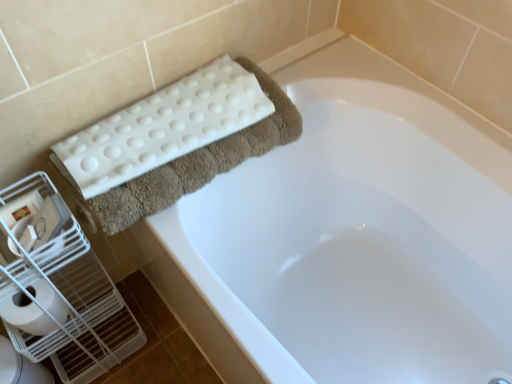
Question: Could you tell me if white glossy toilet bowl at lower left is turned towards white plastic bird cage at left?

Choices:
 (A) yes
 (B) no

Answer: (B)

Question: Is white glossy toilet bowl at lower left shorter than white plastic bird cage at left?

Choices:
 (A) no
 (B) yes

Answer: (B)

Question: Can you confirm if white glossy toilet bowl at lower left is wider than white plastic bird cage at left?

Choices:
 (A) yes
 (B) no

Answer: (A)

Question: Can you confirm if white glossy toilet bowl at lower left is bigger than white plastic bird cage at left?

Choices:
 (A) no
 (B) yes

Answer: (A)

Question: From the image's perspective, is white glossy toilet bowl at lower left beneath white plastic bird cage at left?

Choices:
 (A) yes
 (B) no

Answer: (A)

Question: Is white rubber mat at upper left in front of or behind white matte toilet paper at lower left in the image?

Choices:
 (A) front
 (B) behind

Answer: (A)

Question: Is white rubber mat at upper left inside or outside of white matte toilet paper at lower left?

Choices:
 (A) outside
 (B) inside

Answer: (A)

Question: Is white rubber mat at upper left wider or thinner than white matte toilet paper at lower left?

Choices:
 (A) thin
 (B) wide

Answer: (B)

Question: From their relative heights in the image, would you say white rubber mat at upper left is taller or shorter than white matte toilet paper at lower left?

Choices:
 (A) tall
 (B) short

Answer: (A)

Question: In terms of width, does white rubber mat at upper left look wider or thinner when compared to white textured bath towel at upper left?

Choices:
 (A) thin
 (B) wide

Answer: (B)

Question: Is white rubber mat at upper left spatially inside white textured bath towel at upper left, or outside of it?

Choices:
 (A) outside
 (B) inside

Answer: (A)

Question: Would you say white rubber mat at upper left is to the left or to the right of white textured bath towel at upper left in the picture?

Choices:
 (A) left
 (B) right

Answer: (B)

Question: Does point click(x=473, y=130) appear closer or farther from the camera than point click(x=129, y=142)?

Choices:
 (A) closer
 (B) farther

Answer: (B)

Question: Is white matte toilet paper at lower left inside or outside of white plastic bird cage at left?

Choices:
 (A) inside
 (B) outside

Answer: (A)

Question: Is white matte toilet paper at lower left in front of or behind white plastic bird cage at left in the image?

Choices:
 (A) front
 (B) behind

Answer: (B)